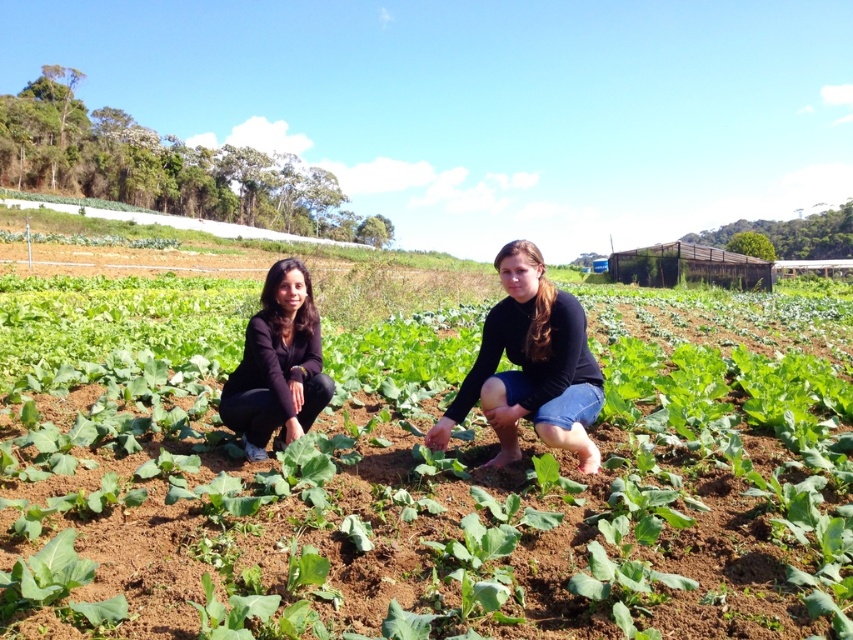
Can you confirm if black matte jeans at center is smaller than black matte jacket at center?

No, black matte jeans at center is not smaller than black matte jacket at center.

Looking at this image, is black matte jeans at center shorter than black matte jacket at center?

Incorrect, black matte jeans at center's height does not fall short of black matte jacket at center's.

What do you see at coordinates (531, 365) in the screenshot?
I see `black matte jeans at center` at bounding box center [531, 365].

Find the location of a particular element. black matte jeans at center is located at coordinates (531, 365).

Is green leafy plant at center shorter than black matte jeans at center?

Incorrect, green leafy plant at center's height does not fall short of black matte jeans at center's.

Who is shorter, green leafy plant at center or black matte jeans at center?

black matte jeans at center

The image size is (853, 640). I want to click on green leafy plant at center, so click(426, 488).

Does green leafy plant at center have a lesser height compared to black matte jacket at center?

Incorrect, green leafy plant at center's height does not fall short of black matte jacket at center's.

Is green leafy plant at center taller than black matte jacket at center?

Yes, green leafy plant at center is taller than black matte jacket at center.

Between point (691, 481) and point (258, 440), which one is positioned in front?

Point (691, 481) is more forward.

This screenshot has width=853, height=640. I want to click on green leafy plant at center, so click(x=426, y=488).